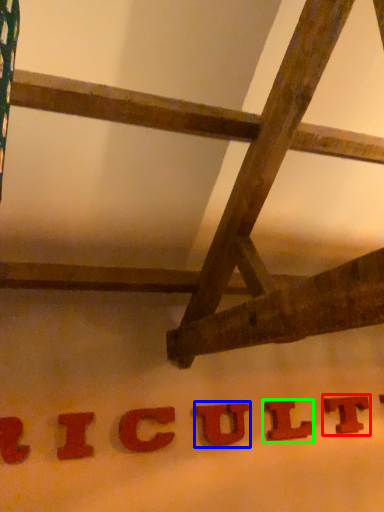
Question: Estimate the real-world distances between objects in this image. Which object is farther from letter (highlighted by a red box), letter (highlighted by a blue box) or letter (highlighted by a green box)?

Choices:
 (A) letter
 (B) letter

Answer: (A)